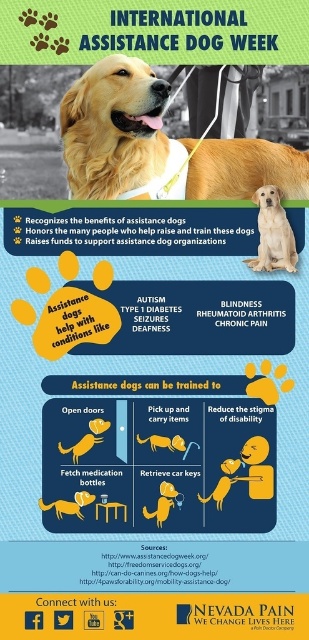
Can you confirm if golden matte fur at center is shorter than matte yellow dog at center?

Incorrect, golden matte fur at center's height does not fall short of matte yellow dog at center's.

Does golden matte fur at center lie behind matte yellow dog at center?

Yes, golden matte fur at center is behind matte yellow dog at center.

Identify the location of golden matte fur at center. This screenshot has height=640, width=309. (159, 145).

At what (x,y) coordinates should I click in order to perform the action: click on golden matte fur at center. Please return your answer as a coordinate pair (x, y). This screenshot has height=640, width=309. Looking at the image, I should click on (159, 145).

Can you confirm if golden fur assistance dog at center is bigger than matte yellow dog at center?

Correct, golden fur assistance dog at center is larger in size than matte yellow dog at center.

Which is behind, point (262, 232) or point (89, 502)?

The point (262, 232) is behind.

Where is `golden fur assistance dog at center`? The width and height of the screenshot is (309, 640). golden fur assistance dog at center is located at coordinates (272, 234).

Is point (90, 124) positioned behind point (274, 204)?

Yes, point (90, 124) is farther from viewer.

Is golden matte fur at center in front of golden fur assistance dog at center?

Yes, it is.

I want to click on golden matte fur at center, so click(x=159, y=145).